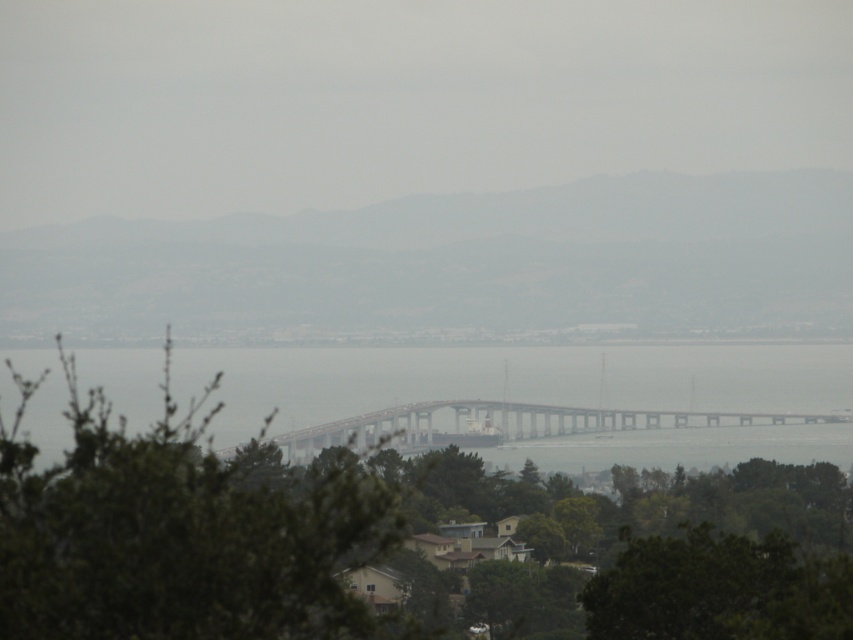
You are a bird flying over the coastal landscape. You want to land on the tallest object between the green leafy tree at center and the metallic gray bridge at center. Which one should you choose?

The green leafy tree at center is taller than the metallic gray bridge at center, so you should land on the green leafy tree at center.